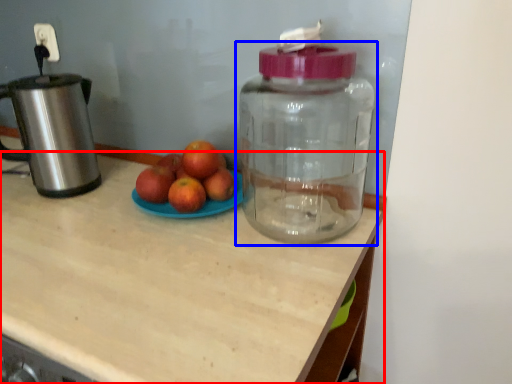
Question: Which object is further to the camera taking this photo, desk (highlighted by a red box) or bottle (highlighted by a blue box)?

Choices:
 (A) desk
 (B) bottle

Answer: (B)